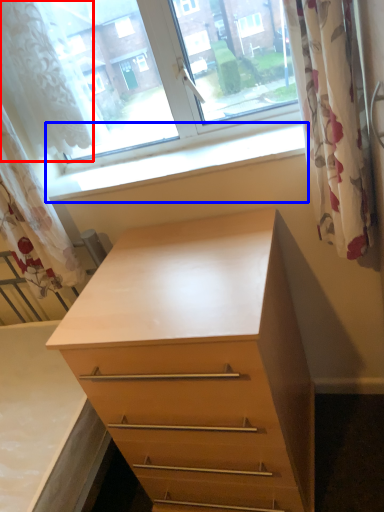
Question: Which object appears closest to the camera in this image, shower curtain (highlighted by a red box) or window sill (highlighted by a blue box)?

Choices:
 (A) shower curtain
 (B) window sill

Answer: (B)